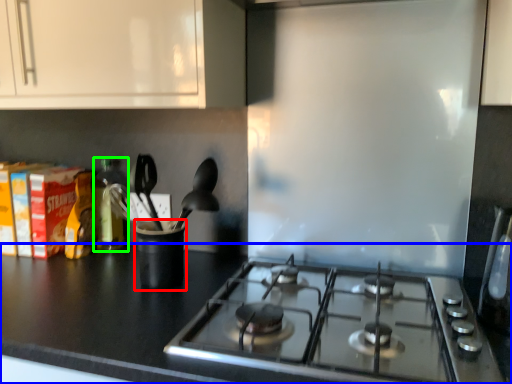
Question: Which object is positioned closest to appliance (highlighted by a red box)? Select from countertop (highlighted by a blue box) and bottle (highlighted by a green box).

Choices:
 (A) countertop
 (B) bottle

Answer: (A)